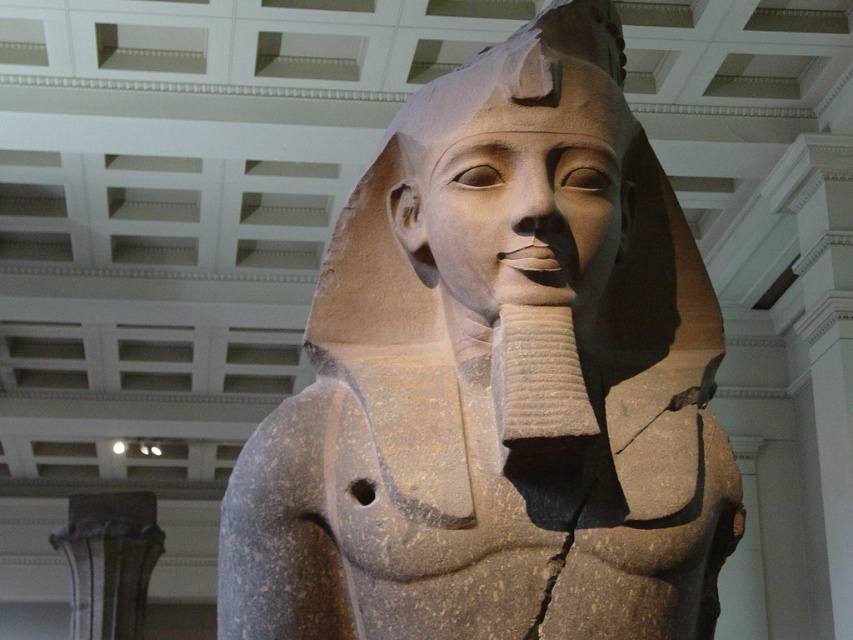
You are an art conservator examining the statue from a distance. You notice two points on the statue marked at coordinates point (250, 568) and point (477, 250). Which point is nearer to your current position?

Point (250, 568) is closer to the viewer than point (477, 250).

You are an art conservator assessing the structural stability of the gray stone statue at center and the smooth stone head at center. Which object has a greater height?

The gray stone statue at center is much taller than the smooth stone head at center, so the gray stone statue at center has a greater height.

You are an archaeologist examining the ancient Egyptian statue in the museum. You notice a specific point marked at coordinates (497, 380). What object is located at that point?

The gray stone statue at center is located at point (497, 380).